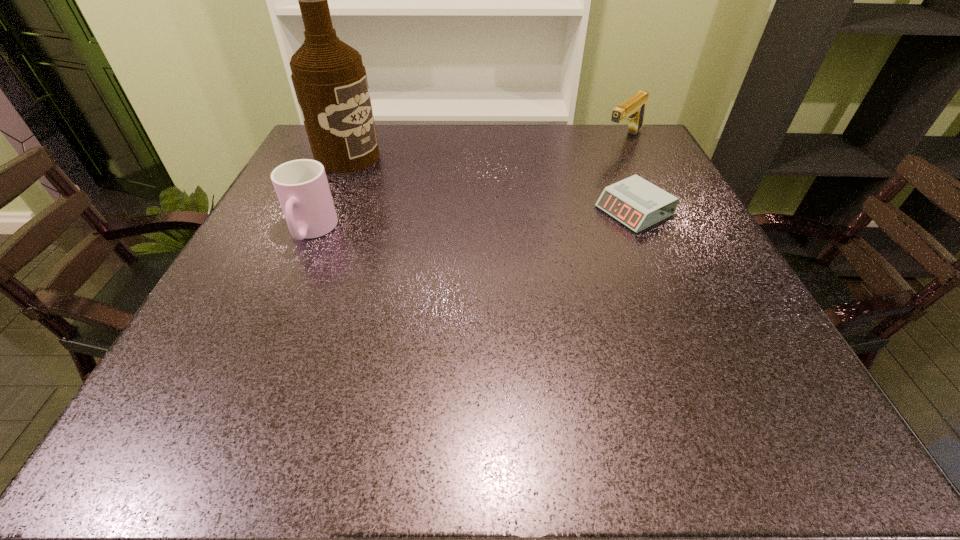
The height and width of the screenshot is (540, 960). In order to click on free space between the pistol and the alarm clock in this screenshot , I will do `click(629, 176)`.

This screenshot has width=960, height=540. Identify the location of free spot between the pistol and the alarm clock. (629, 176).

Identify the location of free spot between the pistol and the cup. (468, 186).

The width and height of the screenshot is (960, 540). I want to click on object that can be found as the second closest to the alcohol, so click(x=636, y=203).

I want to click on object that stands as the second closest to the alarm clock, so click(x=330, y=82).